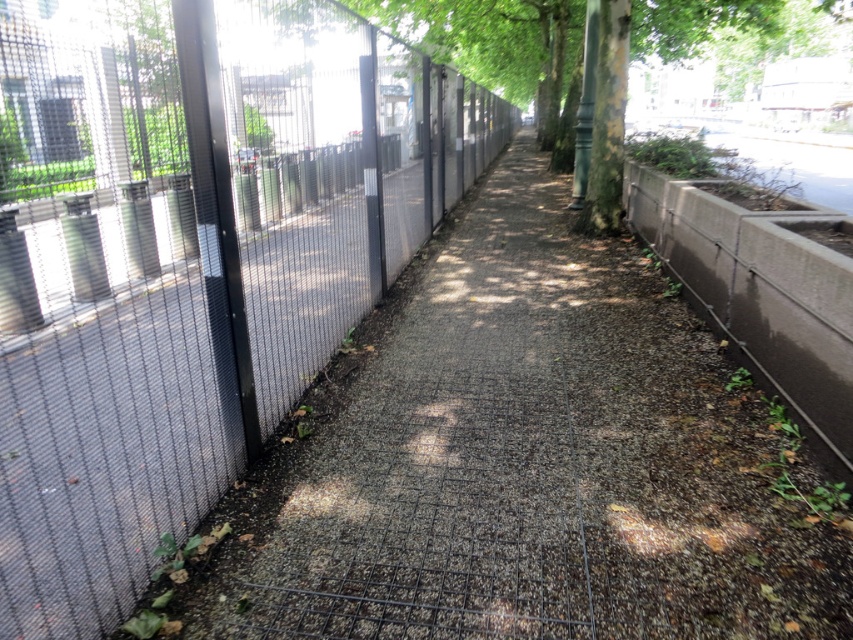
Which is above, metal mesh fence at left or green textured tree at center?

green textured tree at center

Which is more to the left, metal mesh fence at left or green textured tree at center?

metal mesh fence at left

Find the location of a particular element. metal mesh fence at left is located at coordinates (189, 257).

Locate an element on the screen. This screenshot has width=853, height=640. metal mesh fence at left is located at coordinates (189, 257).

Does gray gravel pavement at center have a lesser width compared to green textured tree at center?

Correct, gray gravel pavement at center's width is less than green textured tree at center's.

Is gray gravel pavement at center below green textured tree at center?

Yes.

This screenshot has height=640, width=853. I want to click on gray gravel pavement at center, so click(531, 461).

Which is behind, point (236, 280) or point (252, 550)?

Point (236, 280)

Is metal mesh fence at left positioned at the back of gray gravel pavement at center?

No, metal mesh fence at left is closer to the viewer.

Which is in front, point (51, 227) or point (413, 401)?

Positioned in front is point (413, 401).

Find the location of `metal mesh fence at left`. metal mesh fence at left is located at coordinates (189, 257).